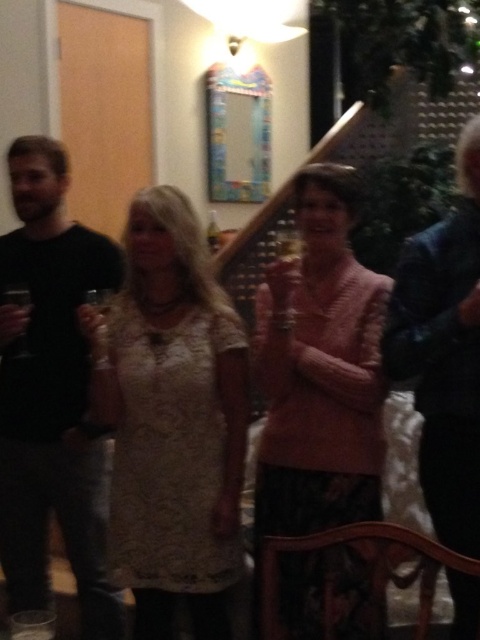
Question: Which object appears farthest from the camera in this image?

Choices:
 (A) white lace dress at center
 (B) dark blue jacket at upper right

Answer: (A)

Question: Is the position of black matte shirt at left less distant than that of dark blue jacket at upper right?

Choices:
 (A) yes
 (B) no

Answer: (B)

Question: Which of the following is the closest to the observer?

Choices:
 (A) white lace dress at center
 (B) clear plastic cup at lower left
 (C) dark blue jacket at upper right

Answer: (B)

Question: Does pink knitted sweater at center have a smaller size compared to black matte shirt at left?

Choices:
 (A) yes
 (B) no

Answer: (B)

Question: Can you confirm if black matte shirt at left is positioned above clear plastic cup at lower left?

Choices:
 (A) no
 (B) yes

Answer: (B)

Question: Which point is closer to the camera?

Choices:
 (A) 15,348
 (B) 205,465
 (C) 36,634
 (D) 85,268

Answer: (C)